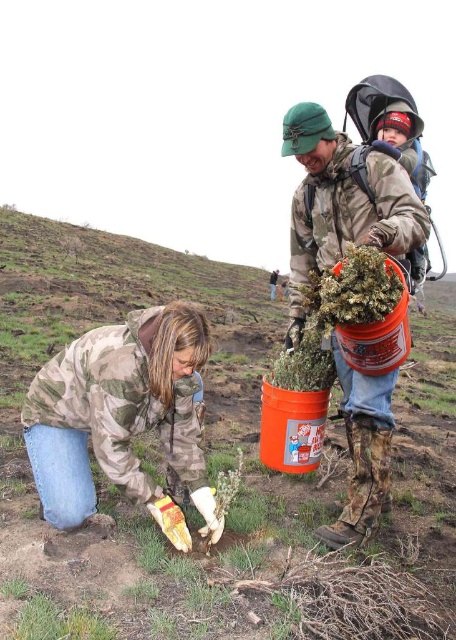
Question: Which of the following is the closest to the observer?

Choices:
 (A) camouflage jacket at lower left
 (B) camouflage jacket at center

Answer: (A)

Question: Can you confirm if camouflage jacket at lower left is wider than camouflage jacket at center?

Choices:
 (A) no
 (B) yes

Answer: (B)

Question: Does camouflage jacket at lower left appear on the left side of camouflage jacket at center?

Choices:
 (A) no
 (B) yes

Answer: (B)

Question: Can you confirm if camouflage jacket at lower left is wider than camouflage jacket at center?

Choices:
 (A) no
 (B) yes

Answer: (B)

Question: Which of the following is the farthest from the observer?

Choices:
 (A) (160, 502)
 (B) (356, 429)

Answer: (B)